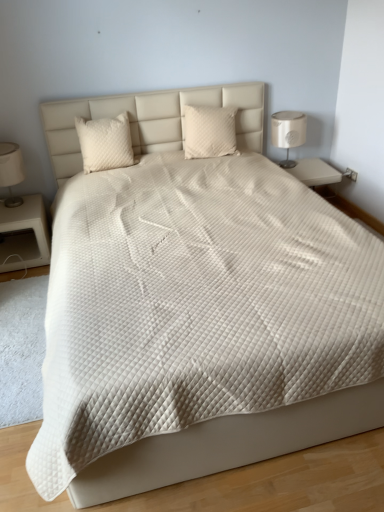
At what (x,y) coordinates should I click in order to perform the action: click on free point above white soft carpet at lower left (from a real-world perspective). Please return your answer as a coordinate pair (x, y). Looking at the image, I should click on (16, 326).